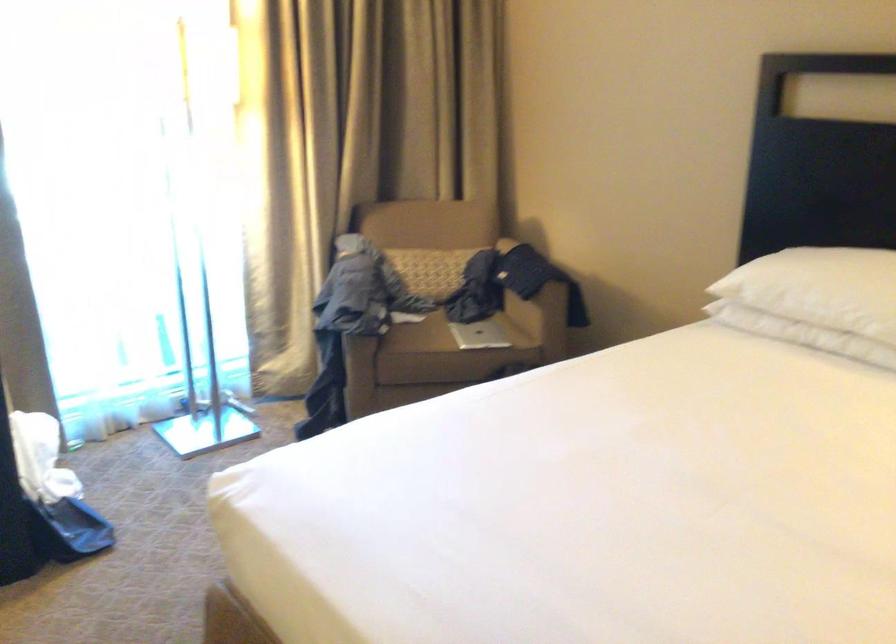
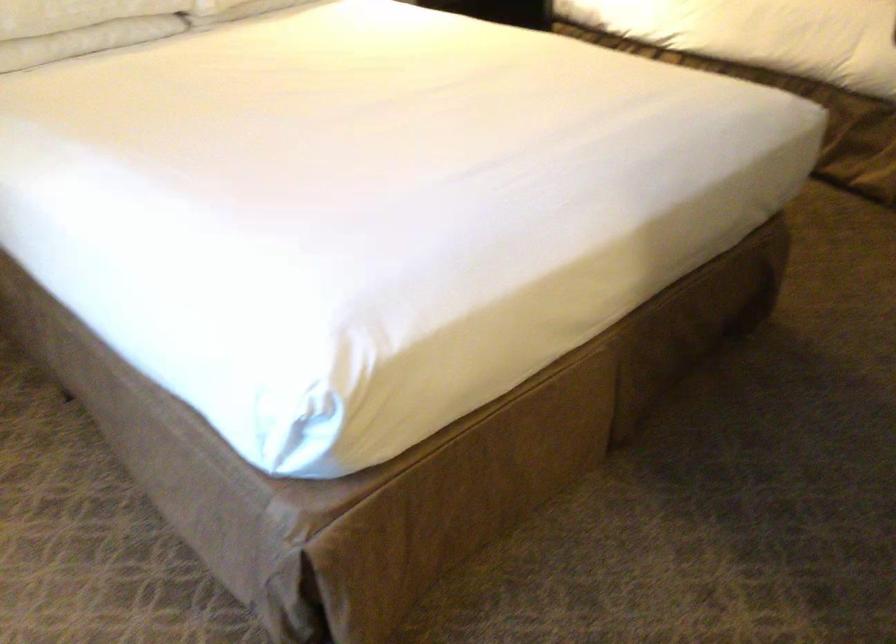
The point at [815,323] is marked in the first image. Where is the corresponding point in the second image?

(81, 26)